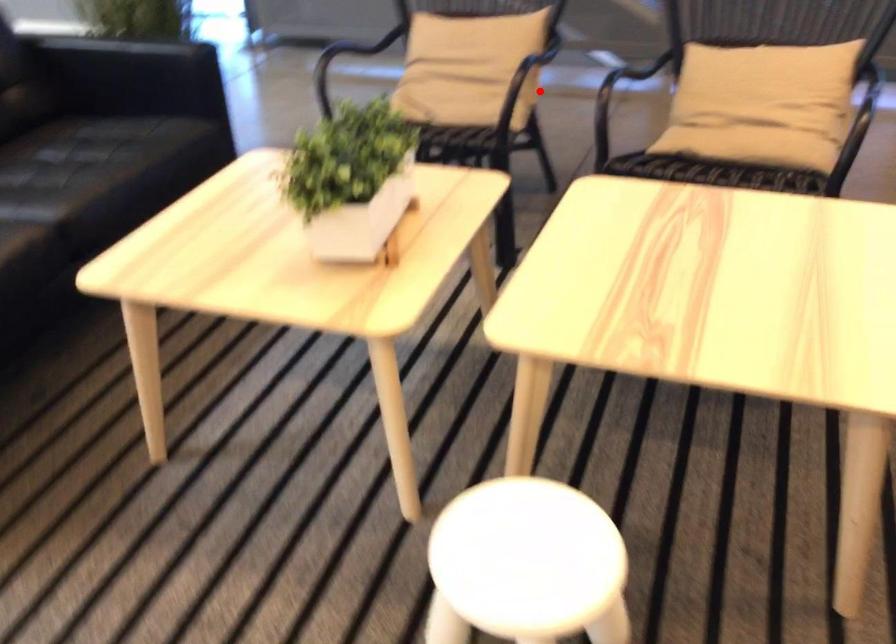
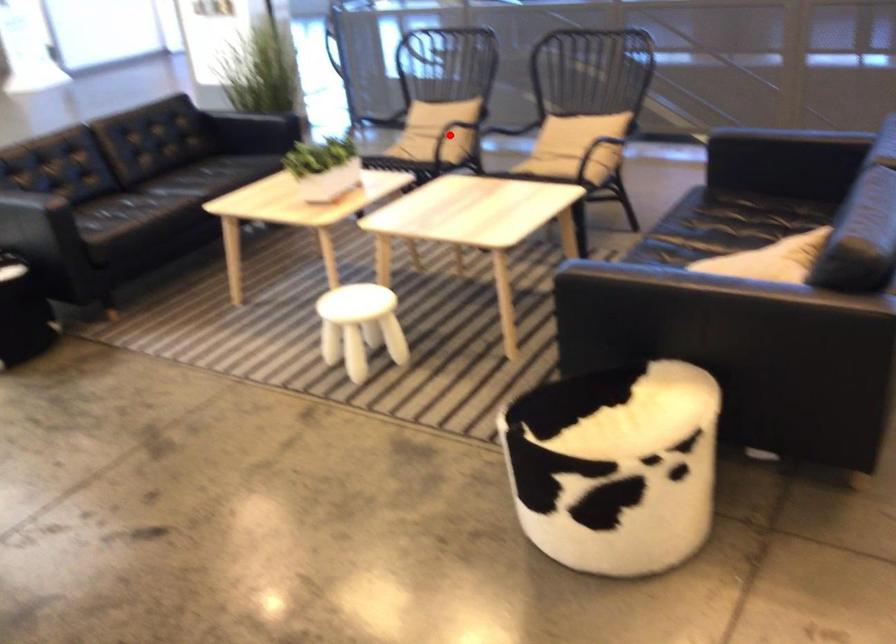
I am providing you with two images of the same scene from different viewpoints. A red point is marked on the first image and another point is marked on the second image. Is the marked point in image1 the same physical position as the marked point in image2?

Yes